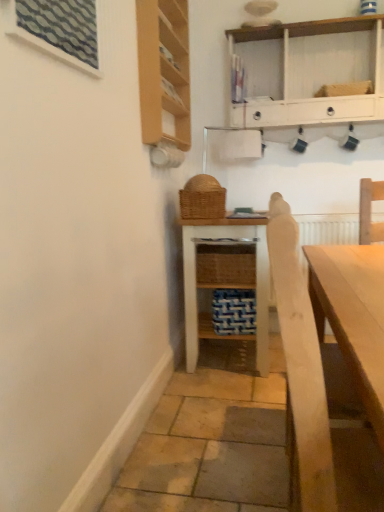
Question: Is point (190, 358) closer or farther from the camera than point (203, 214)?

Choices:
 (A) farther
 (B) closer

Answer: (A)

Question: In terms of width, does white wicker shelf at center, placed as the 1th shelf when sorted from bottom to top, look wider or thinner when compared to woven brown basket at center?

Choices:
 (A) thin
 (B) wide

Answer: (B)

Question: Estimate the real-world distances between objects in this image. Which object is farther from the light wood cabinet at upper left?

Choices:
 (A) white wicker shelf at center, placed as the 1th shelf when sorted from bottom to top
 (B) textured glass window at upper left
 (C) woven brown basket at center
 (D) light brown wooden armchair at right
 (E) white painted wood shelf at upper center, positioned as the second shelf in bottom-to-top order

Answer: (D)

Question: Estimate the real-world distances between objects in this image. Which object is closer to the woven brown basket at center?

Choices:
 (A) light brown wooden armchair at right
 (B) white wicker shelf at center, placed as the 1th shelf when sorted from bottom to top
 (C) light wood cabinet at upper left
 (D) white painted wood shelf at upper center, arranged as the first shelf when viewed from the top
 (E) textured glass window at upper left

Answer: (B)